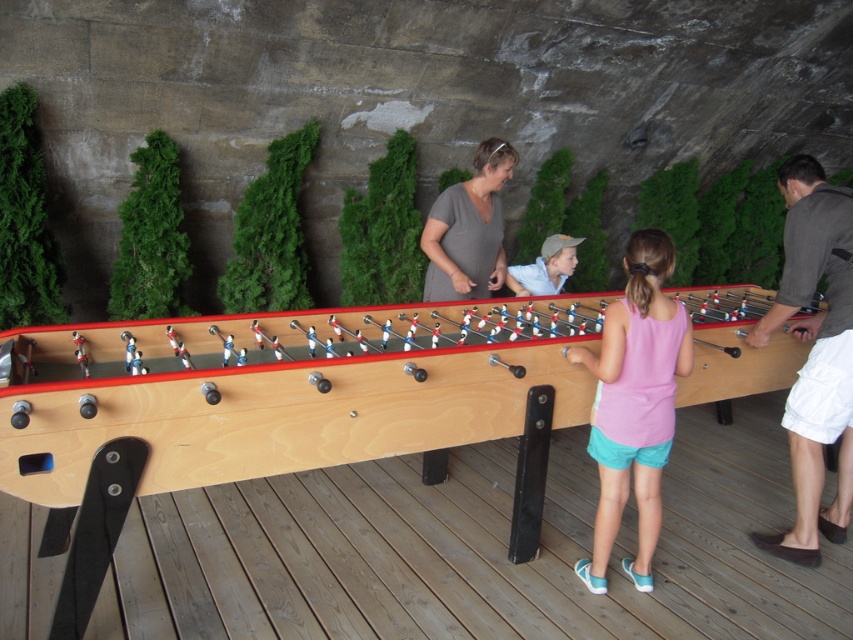
Question: Can you confirm if dark gray fabric shirt at right is smaller than pink fabric shirt at center?

Choices:
 (A) yes
 (B) no

Answer: (B)

Question: Does dark gray fabric shirt at right have a greater width compared to light blue denim shorts at center?

Choices:
 (A) yes
 (B) no

Answer: (A)

Question: Which of the following is the farthest from the observer?

Choices:
 (A) matte gray shirt at center
 (B) light blue denim shorts at center
 (C) dark gray fabric shirt at right
 (D) pink fabric shirt at center

Answer: (B)

Question: Estimate the real-world distances between objects in this image. Which object is closer to the dark gray fabric shirt at right?

Choices:
 (A) light blue denim shorts at center
 (B) matte gray shirt at center
 (C) pink fabric shirt at center

Answer: (C)

Question: Is pink fabric shirt at center positioned behind light blue denim shorts at center?

Choices:
 (A) yes
 (B) no

Answer: (B)

Question: Which point is closer to the camera?

Choices:
 (A) dark gray fabric shirt at right
 (B) matte gray shirt at center

Answer: (A)